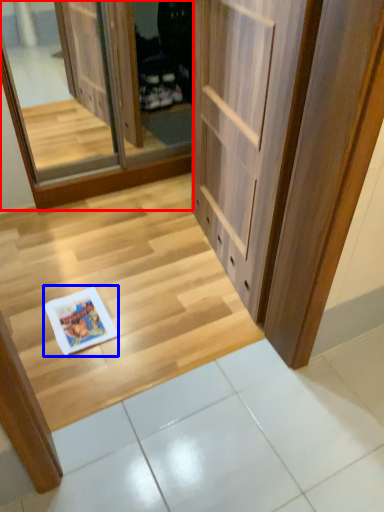
Question: Which point is closer to the camera, screen door (highlighted by a red box) or magazine (highlighted by a blue box)?

Choices:
 (A) screen door
 (B) magazine

Answer: (B)